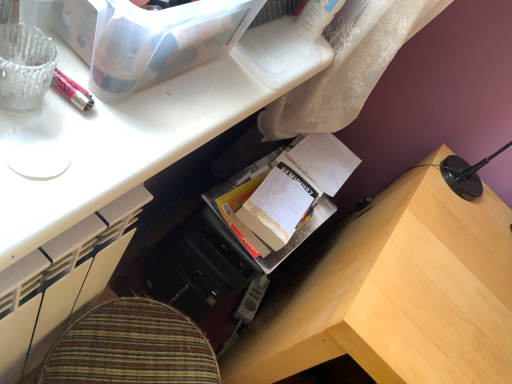
The image size is (512, 384). I want to click on vacant area on top of wooden desk at center (from a real-world perspective), so click(203, 65).